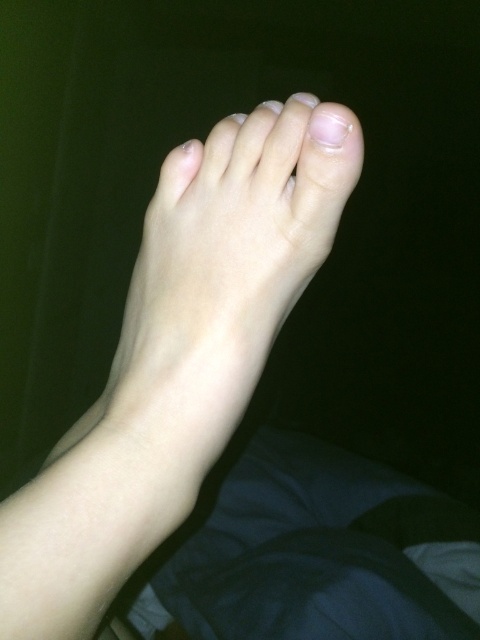
What do you see at coordinates (328, 125) in the screenshot? The image size is (480, 640). I see `glossy white nail at upper center` at bounding box center [328, 125].

Who is shorter, glossy white nail at upper center or smooth skin toe at upper center?

smooth skin toe at upper center is shorter.

Based on the photo, who is more forward, (335, 140) or (272, 106)?

Point (335, 140)

Identify the location of glossy white nail at upper center. (328, 125).

What do you see at coordinates (179, 170) in the screenshot? I see `pale skin toe at center` at bounding box center [179, 170].

From the picture: Is pale skin toe at center positioned behind smooth skin toe at upper center?

Yes.

Image resolution: width=480 pixels, height=640 pixels. What are the coordinates of `pale skin toe at center` in the screenshot? It's located at (179, 170).

Is smooth skin toe at upper center taller than smooth skin toe at center?

Incorrect, smooth skin toe at upper center's height is not larger of smooth skin toe at center's.

Who is taller, smooth skin toe at upper center or smooth skin toe at center?

smooth skin toe at center

Who is more forward, (278, 108) or (240, 115)?

Point (278, 108)

Locate an element on the screen. The height and width of the screenshot is (640, 480). smooth skin toe at upper center is located at coordinates (273, 106).